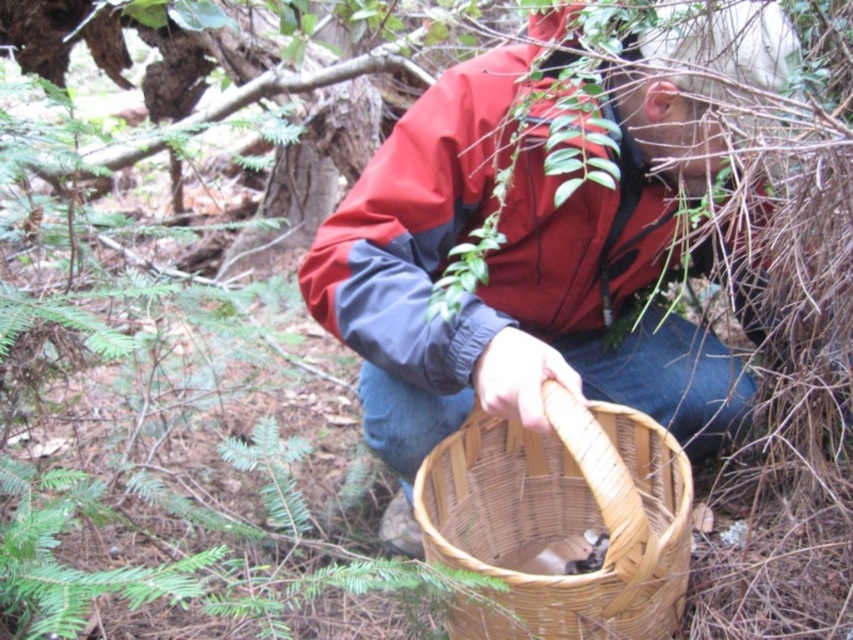
Is point (660, 388) closer to camera compared to point (639, 432)?

No, (660, 388) is behind (639, 432).

Does point (393, 243) lie in front of point (605, 609)?

No, (393, 243) is behind (605, 609).

I want to click on matte brown basket at center, so click(x=520, y=268).